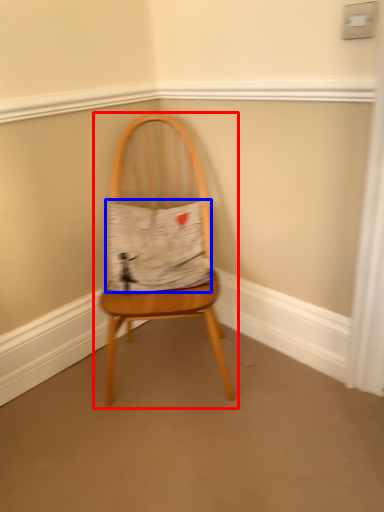
Question: Which object appears farthest to the camera in this image, chair (highlighted by a red box) or fabric (highlighted by a blue box)?

Choices:
 (A) chair
 (B) fabric

Answer: (B)